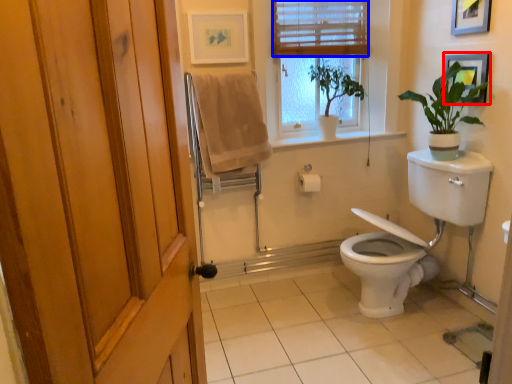
Question: Which point is further to the camera, picture frame (highlighted by a red box) or blind (highlighted by a blue box)?

Choices:
 (A) picture frame
 (B) blind

Answer: (B)